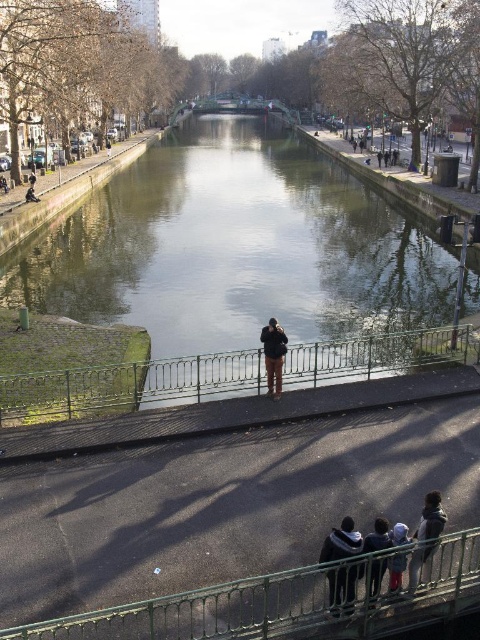
Which of these two, green metal railing at lower center or dark gray hoodie at lower center, stands taller?

With more height is green metal railing at lower center.

Is green metal railing at lower center wider than dark gray hoodie at lower center?

Indeed, green metal railing at lower center has a greater width compared to dark gray hoodie at lower center.

The width and height of the screenshot is (480, 640). Describe the element at coordinates (295, 600) in the screenshot. I see `green metal railing at lower center` at that location.

Where is `green metal railing at lower center`? This screenshot has width=480, height=640. green metal railing at lower center is located at coordinates (295, 600).

Is point (303, 292) positioned behind point (264, 374)?

That is True.

Is green concrete river at center further to the viewer compared to green metal railing at center?

Yes, it is behind green metal railing at center.

The width and height of the screenshot is (480, 640). I want to click on green concrete river at center, so click(x=238, y=257).

You are a GUI agent. You are given a task and a screenshot of the screen. Output one action in this format:
    pyautogui.click(x=<x>, y=<y>)
    Task: Click on the green concrete river at center
    The height and width of the screenshot is (640, 480).
    Given the screenshot: What is the action you would take?
    pyautogui.click(x=238, y=257)

Between dark gray hoodie at lower center and dark blue jeans at lower center, which one is positioned higher?

Positioned higher is dark blue jeans at lower center.

Which is in front, point (355, 586) or point (383, 548)?

Point (383, 548)

Image resolution: width=480 pixels, height=640 pixels. I want to click on dark gray hoodie at lower center, so click(342, 541).

Image resolution: width=480 pixels, height=640 pixels. Find the location of `dark gray hoodie at lower center`. dark gray hoodie at lower center is located at coordinates (342, 541).